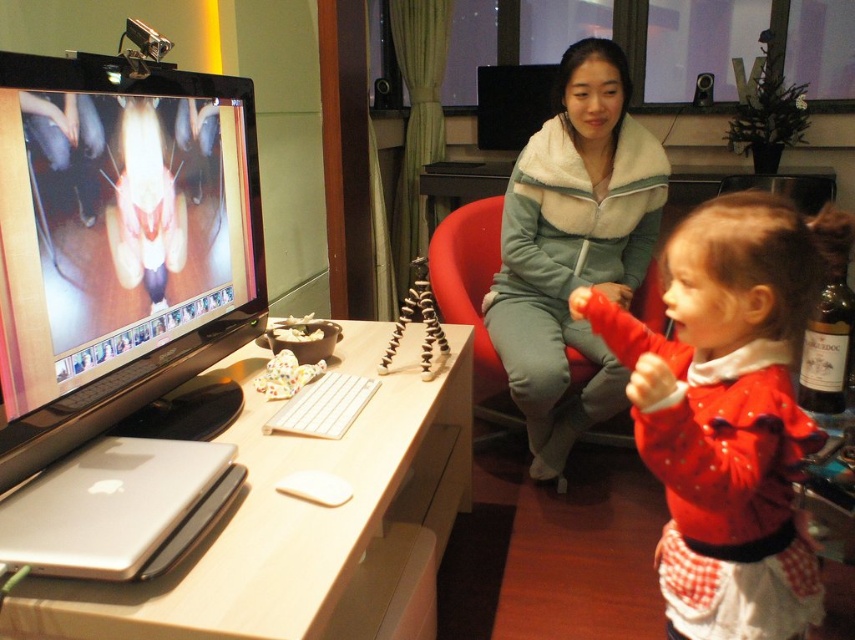
You are setting up a new camera on the rubberized black tripod at center. To ensure the camera is stable, you need to place it so it doesn not tip over. Considering the red fabric swivel chair at center is directly underneath, where should you position the camera relative to the chair?

The red fabric swivel chair at center is positioned under the rubberized black tripod at center, so placing the camera directly above the chair would ensure stability as the tripod is already centered over the chair.

You are planning to place a new plant pot that is 20 cm in diameter on the desk. Considering the red fabric swivel chair at center and the rubberized black tripod at center, which object would allow more space around it for the plant pot?

The red fabric swivel chair at center has a larger size compared to the rubberized black tripod at center, so placing the plant pot near the tripod would leave more space around it.

You are organizing a small desk space and need to place a 30 cm wide decorative item between the light green fleece jacket at center and the brown glass bottle at right. Is there enough space?

The distance between the light green fleece jacket at center and the brown glass bottle at right is 72.37 centimeters. Since the decorative item is only 30 cm wide, there is sufficient space to place it between them.